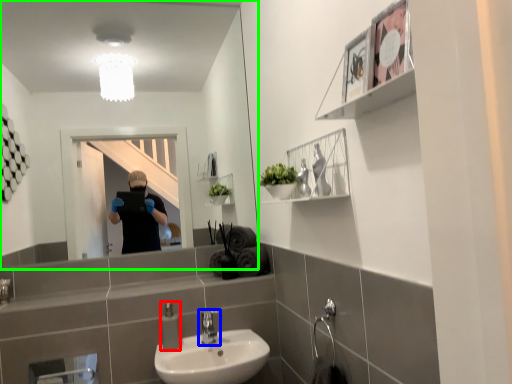
Question: Based on their relative distances, which object is farther from soap dispenser (highlighted by a red box)? Choose from tap (highlighted by a blue box) and mirror (highlighted by a green box).

Choices:
 (A) tap
 (B) mirror

Answer: (B)